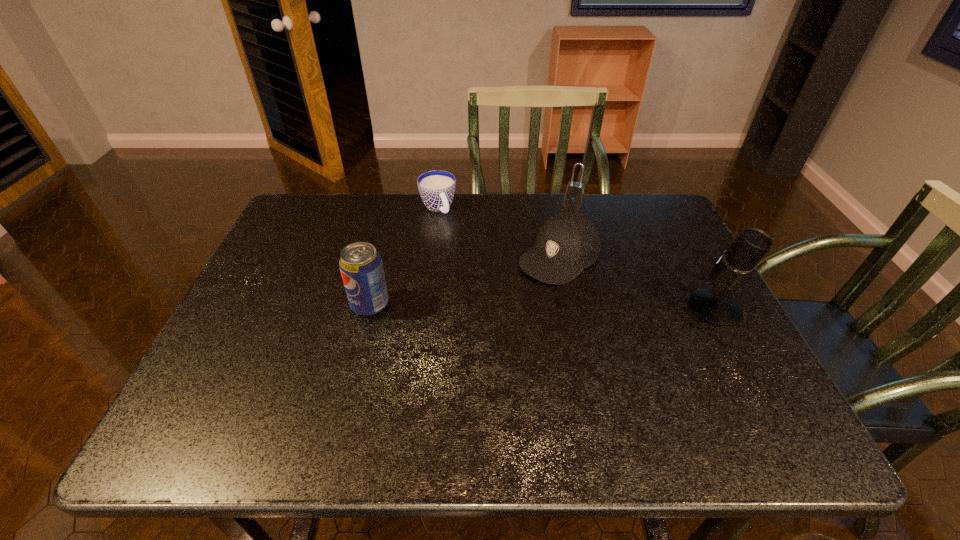
Identify the location of vacant region located on the front-facing side of the third nearest object. (481, 320).

Find the location of a particular element. vacant space situated 0.150m on the front-facing side of the third nearest object is located at coordinates tap(495, 308).

Locate an element on the screen. free region located 0.140m on the front-facing side of the third nearest object is located at coordinates (497, 306).

The height and width of the screenshot is (540, 960). Find the location of `free space located 0.060m on the side of the shortest object with the handle`. free space located 0.060m on the side of the shortest object with the handle is located at coordinates (450, 232).

Find the location of a particular element. The width and height of the screenshot is (960, 540). free region located 0.180m on the side of the shortest object with the handle is located at coordinates (466, 256).

Locate an element on the screen. free space located 0.050m on the side of the shortest object with the handle is located at coordinates (449, 230).

Locate an element on the screen. Image resolution: width=960 pixels, height=540 pixels. blank space located 0.050m on the shackle of the padlock is located at coordinates (567, 211).

Find the location of a particular element. This screenshot has width=960, height=540. free space located 0.350m on the shackle of the padlock is located at coordinates (541, 271).

This screenshot has width=960, height=540. What are the coordinates of `vacant space positioned on the shackle of the padlock` in the screenshot? It's located at (539, 278).

Identify the location of cap that is at the far edge. The image size is (960, 540). (567, 243).